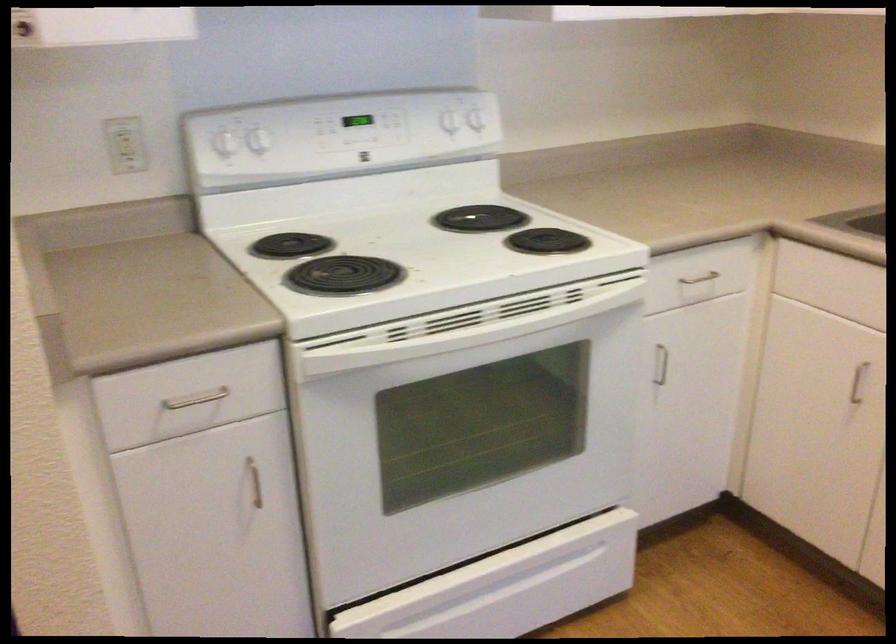
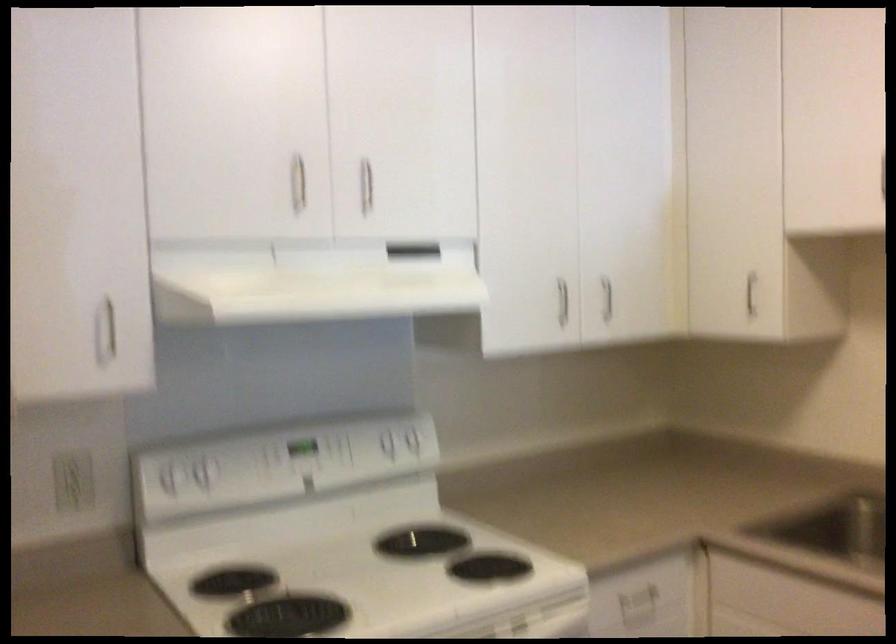
The point at (483, 124) is marked in the first image. Where is the corresponding point in the second image?

(419, 444)